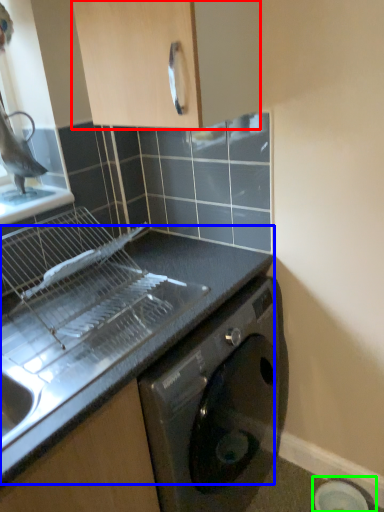
Question: Considering the real-world distances, which object is farthest from cabinetry (highlighted by a red box)? countertop (highlighted by a blue box) or appliance (highlighted by a green box)?

Choices:
 (A) countertop
 (B) appliance

Answer: (B)